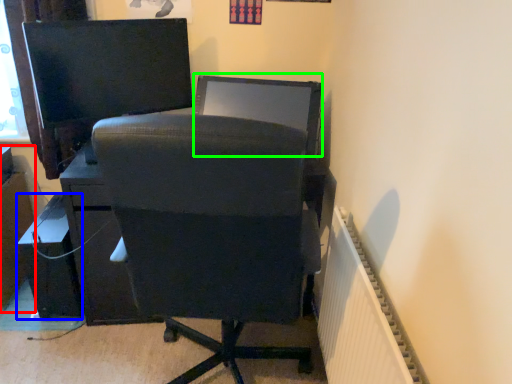
Question: Which object is positioned closest to file cabinet (highlighted by a red box)? Select from furniture (highlighted by a blue box) and computer monitor (highlighted by a green box).

Choices:
 (A) furniture
 (B) computer monitor

Answer: (A)